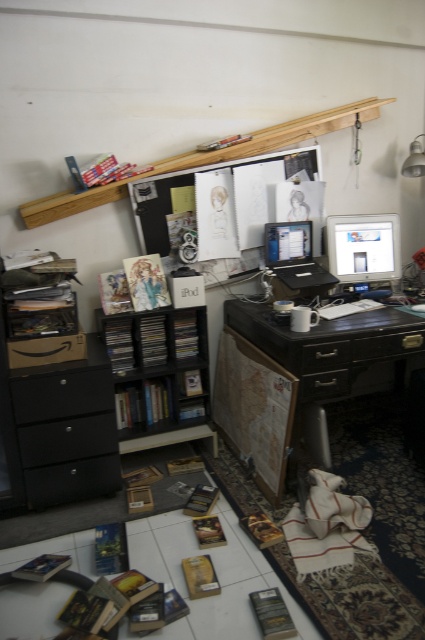
You are standing in the room and want to reach the black matte file cabinet at lower left. Is it within arm reach or do you need to take a step forward?

The black matte file cabinet at lower left is 2.08 meters away from viewer, so you need to take a step forward to reach it.

You are organizing the cluttered workspace and need to move the black matte file cabinet at lower left and the matte silver monitor at center. Which object should you move first to access the other?

You should move the black matte file cabinet at lower left first because it is closer to the viewer than the matte silver monitor at center, so moving it first would allow access to the monitor.